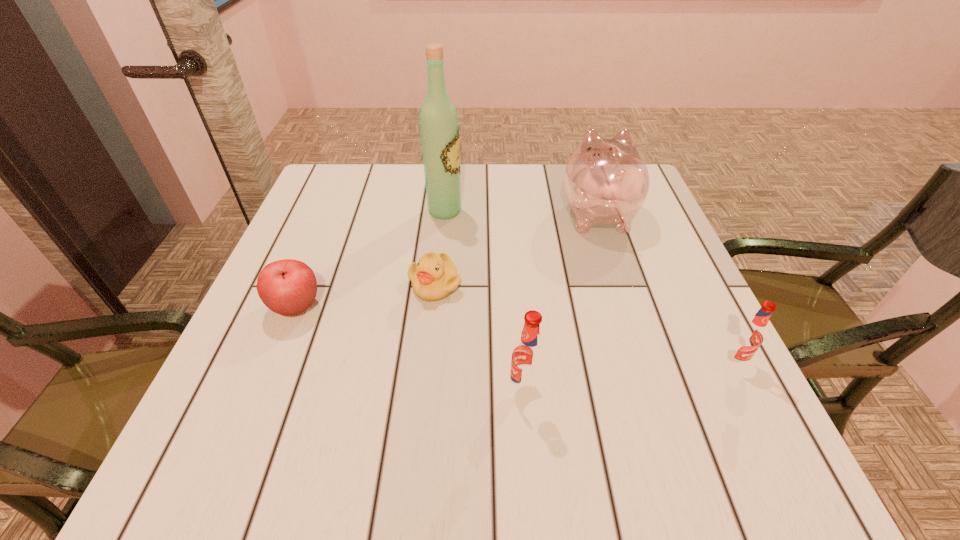
Identify the location of object at the left edge. (288, 287).

At what (x,y) coordinates should I click in order to perform the action: click on root beer that is at the right edge. Please return your answer as a coordinate pair (x, y). The height and width of the screenshot is (540, 960). Looking at the image, I should click on (749, 336).

At what (x,y) coordinates should I click in order to perform the action: click on piggy bank at the right edge. Please return your answer as a coordinate pair (x, y). Looking at the image, I should click on (606, 181).

Where is `object situated at the far right corner`? The image size is (960, 540). object situated at the far right corner is located at coordinates (606, 181).

Find the location of a particular element. This screenshot has width=960, height=540. free space at the far edge is located at coordinates (492, 207).

Identify the location of vacant space at the near edge. The width and height of the screenshot is (960, 540). (415, 413).

In order to click on vacant area at the left edge of the desktop in this screenshot , I will do `click(305, 260)`.

Where is `vacant space at the right edge`? The image size is (960, 540). vacant space at the right edge is located at coordinates tap(658, 239).

This screenshot has width=960, height=540. I want to click on vacant space at the far left corner, so click(313, 202).

Find the location of `vacant point located between the apple and the shortest object`. vacant point located between the apple and the shortest object is located at coordinates (366, 295).